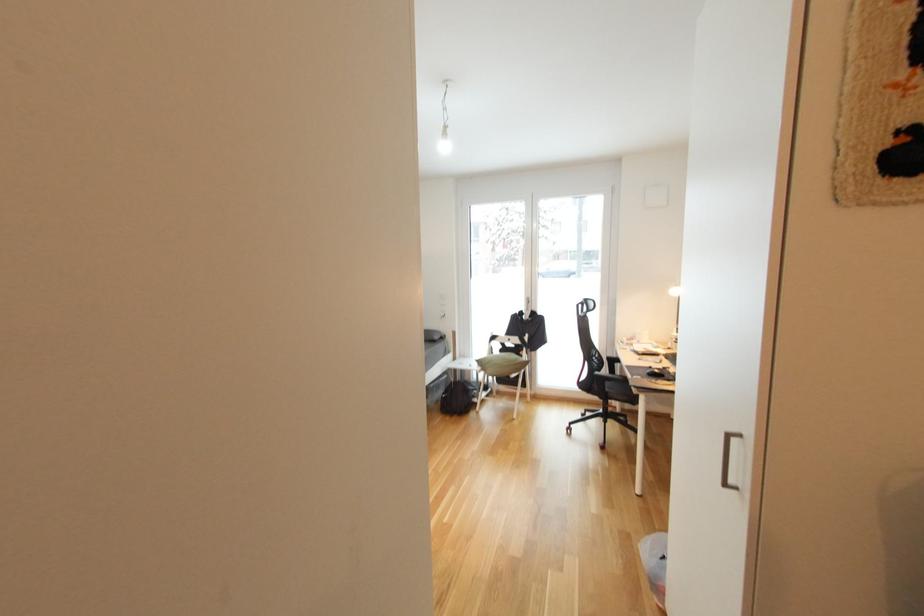
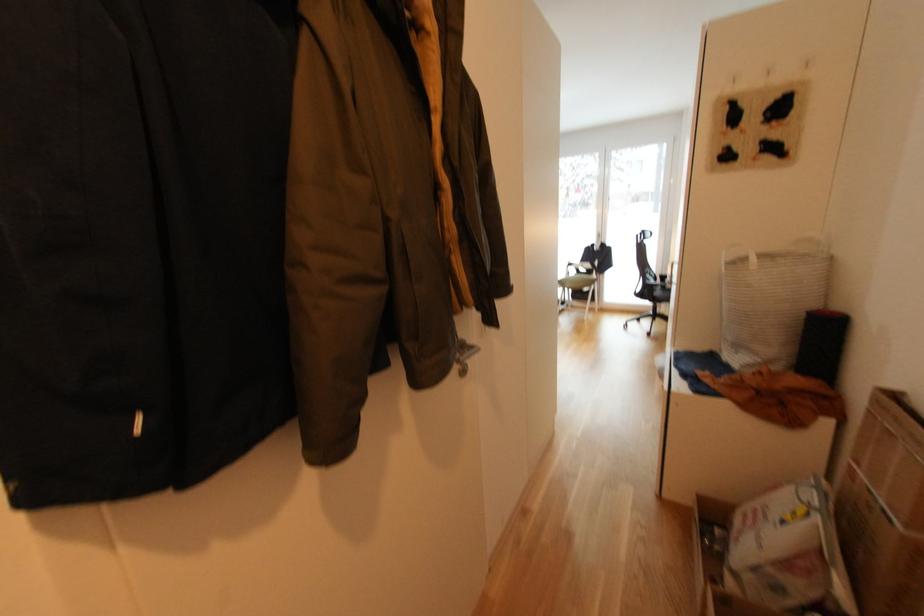
Question: The images are taken continuously from a first-person perspective. In which direction are you moving?

Choices:
 (A) Left
 (B) Right
 (C) Forward
 (D) Backward

Answer: (D)